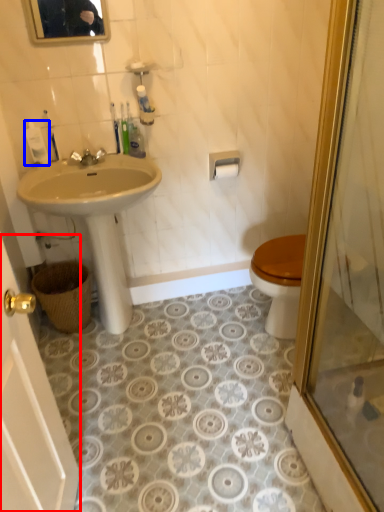
Question: Which point is closer to the camera, screen door (highlighted by a red box) or toiletry (highlighted by a blue box)?

Choices:
 (A) screen door
 (B) toiletry

Answer: (A)